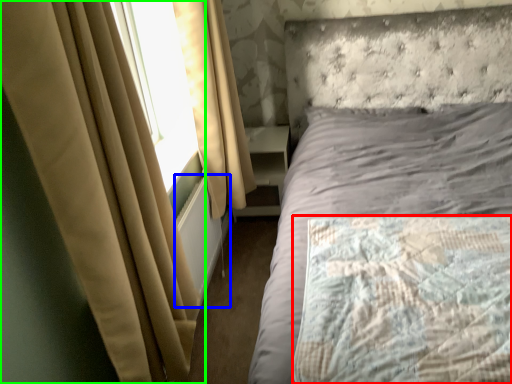
Question: Which is nearer to the mattress (highlighted by a red box)? radiator (highlighted by a blue box) or curtain (highlighted by a green box).

Choices:
 (A) radiator
 (B) curtain

Answer: (B)